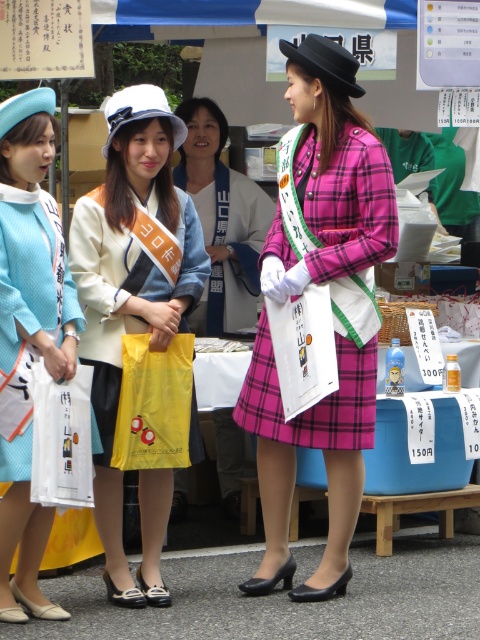
Question: Which point appears farthest from the camera in this image?

Choices:
 (A) (103, 240)
 (B) (27, 337)
 (C) (223, 177)

Answer: (C)

Question: Based on their relative distances, which object is farther from the pink plaid dress at center?

Choices:
 (A) pink plaid skirt at center
 (B) matte yellow plastic bag at center

Answer: (A)

Question: Does light blue textured fabric dress at left have a lesser width compared to pink plaid skirt at center?

Choices:
 (A) yes
 (B) no

Answer: (A)

Question: Can you confirm if matte yellow plastic bag at center is positioned to the right of pink plaid skirt at center?

Choices:
 (A) yes
 (B) no

Answer: (B)

Question: Can you confirm if matte yellow plastic bag at center is positioned below pink plaid dress at center?

Choices:
 (A) yes
 (B) no

Answer: (A)

Question: Which point is closer to the camera taking this photo?

Choices:
 (A) (96, 284)
 (B) (252, 317)
 (C) (63, 272)

Answer: (C)